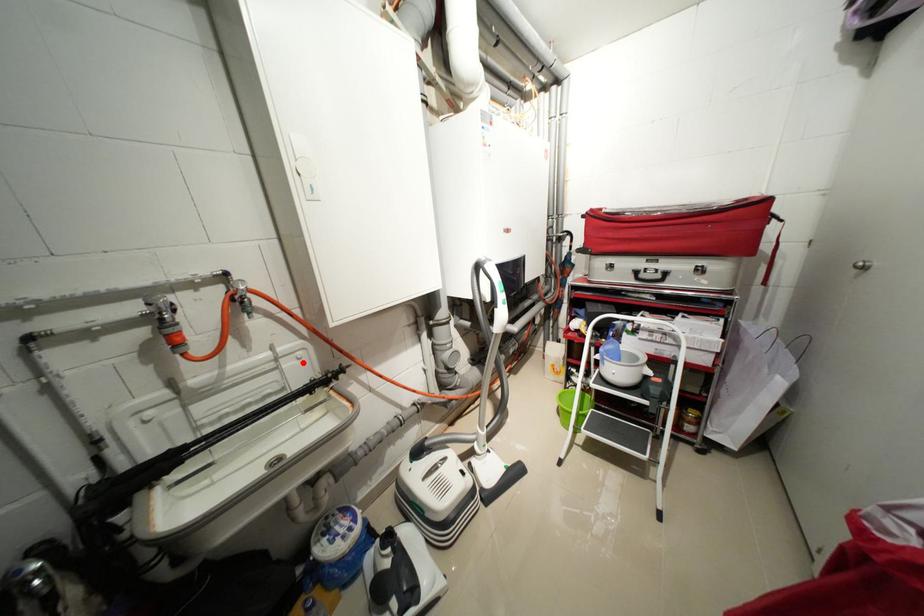
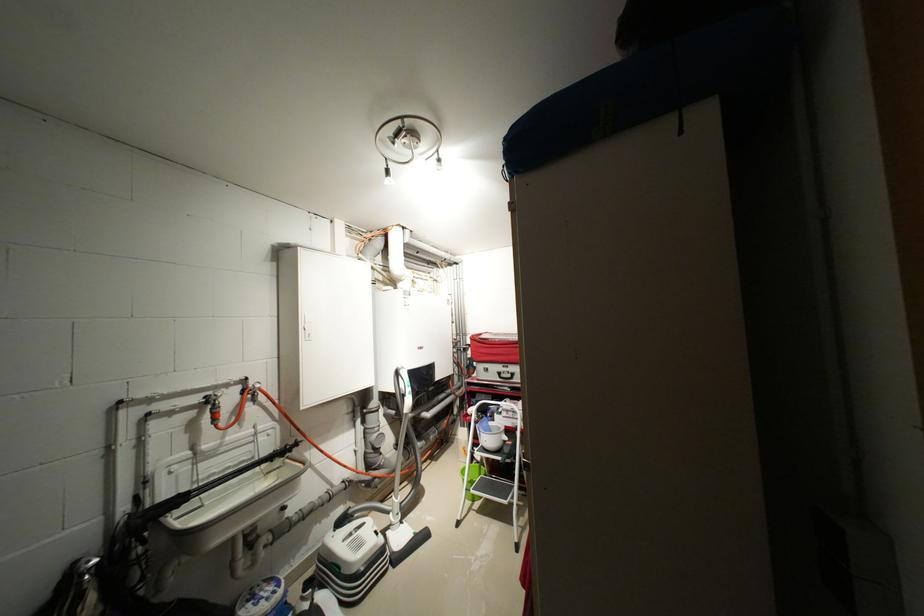
The point at the highlighted location is marked in the first image. Where is the corresponding point in the second image?

(273, 439)